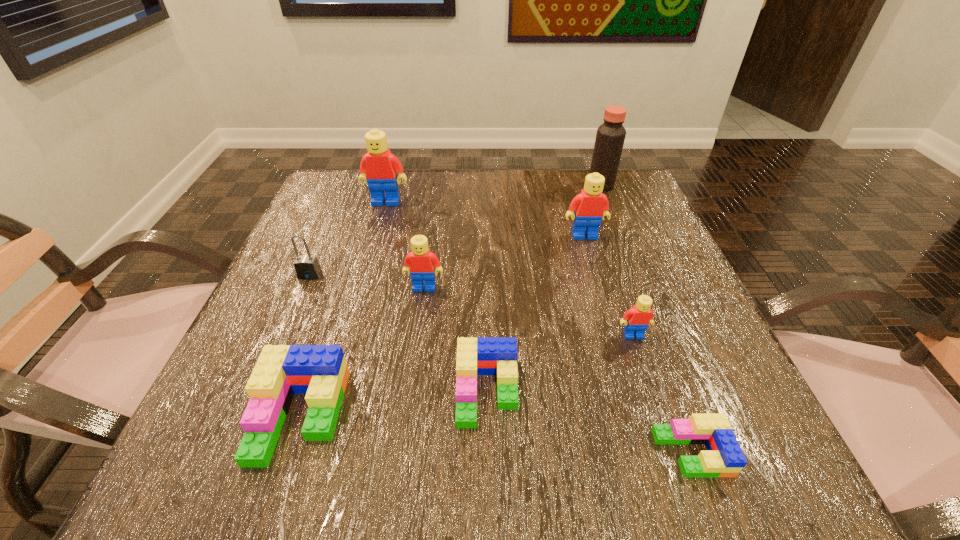
At what (x,y) coordinates should I click in order to perform the action: click on free region at the far right corner. Please return your answer as a coordinate pair (x, y). The image size is (960, 540). Looking at the image, I should click on (630, 217).

Identify the location of free space at the near right corner. The height and width of the screenshot is (540, 960). (783, 480).

Identify the location of vacant area that lies between the third tallest object and the eighth tallest object. This screenshot has width=960, height=540. (536, 314).

Identify the location of free space that is in between the third shortest Lego and the sixth tallest Lego. (394, 404).

Identify the location of vacant region between the second smallest red Lego and the leftmost green Lego. The image size is (960, 540). (362, 352).

The width and height of the screenshot is (960, 540). I want to click on vacant space that is in between the rightmost green Lego and the third farthest Lego, so click(x=558, y=370).

In order to click on free space between the second green Lego from left to right and the shortest object in this screenshot , I will do `click(589, 422)`.

You are a GUI agent. You are given a task and a screenshot of the screen. Output one action in this format:
    pyautogui.click(x=<x>, y=<y>)
    Task: Click on the free space between the fourth farthest Lego and the fifth nearest object
    Image resolution: width=960 pixels, height=540 pixels.
    Given the screenshot: What is the action you would take?
    click(529, 312)

Identify the location of free space that is in between the third nearest red Lego and the padlock. The height and width of the screenshot is (540, 960). (447, 255).

I want to click on unoccupied position between the fifth object from left to right and the smallest green Lego, so click(589, 422).